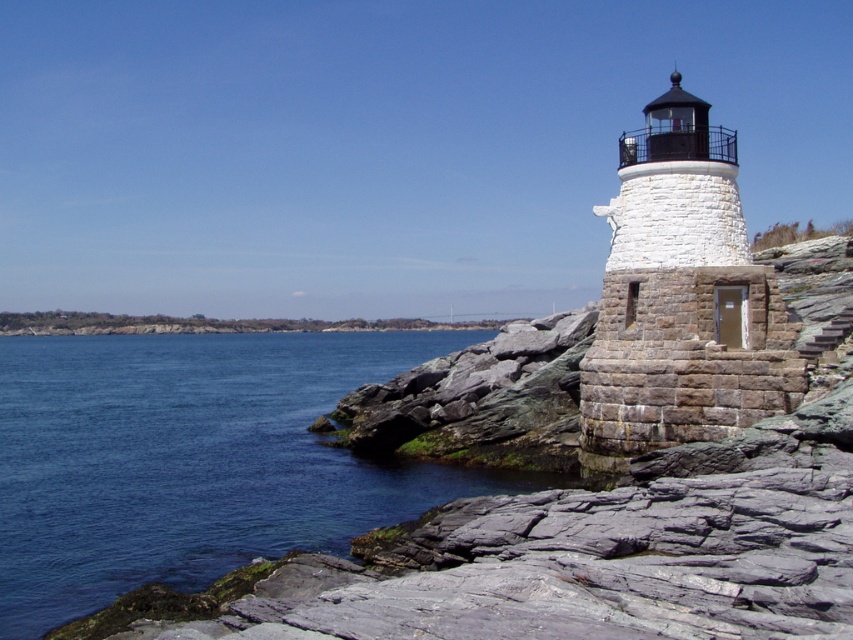
Question: Which object appears closest to the camera in this image?

Choices:
 (A) blue water at lower left
 (B) white stone lighthouse at right
 (C) gray stone stairs at right

Answer: (A)

Question: Is blue water at lower left closer to the viewer compared to white stone lighthouse at right?

Choices:
 (A) yes
 (B) no

Answer: (A)

Question: Which of these objects is positioned closest to the blue water at lower left?

Choices:
 (A) white stone lighthouse at right
 (B) gray stone stairs at right

Answer: (B)

Question: Where is white stone lighthouse at right located in relation to gray stone stairs at right in the image?

Choices:
 (A) below
 (B) above

Answer: (B)

Question: Does white stone lighthouse at right appear on the left side of gray stone stairs at right?

Choices:
 (A) no
 (B) yes

Answer: (B)

Question: Among these objects, which one is farthest from the camera?

Choices:
 (A) blue water at lower left
 (B) white stone lighthouse at right

Answer: (B)